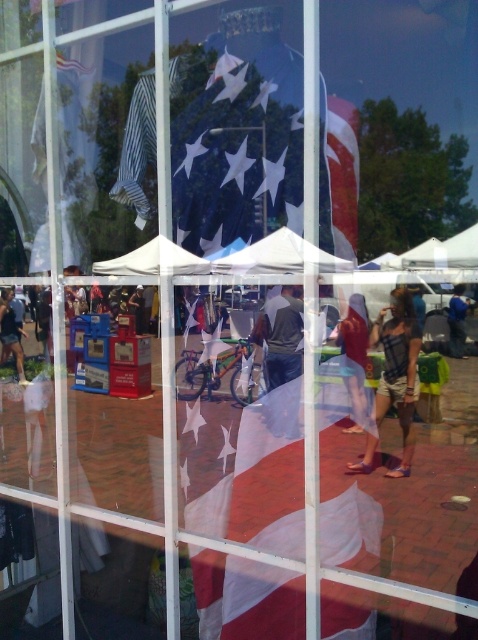
Question: Can you confirm if red fabric flag at center is thinner than light pink fabric at center?

Choices:
 (A) no
 (B) yes

Answer: (B)

Question: Which point is farther to the camera?

Choices:
 (A) light pink fabric at center
 (B) red fabric flag at center

Answer: (A)

Question: Estimate the real-world distances between objects in this image. Which object is farther from the light pink fabric at center?

Choices:
 (A) red fabric flag at center
 (B) dark gray backpack at center
 (C) plaid shirt at center

Answer: (A)

Question: Which point is closer to the camera taking this photo?

Choices:
 (A) (391, 291)
 (B) (362, 308)
 (C) (467, 308)

Answer: (B)

Question: Is plaid shirt at center positioned at the back of red fabric flag at center?

Choices:
 (A) yes
 (B) no

Answer: (A)

Question: Where is light pink fabric at center located in relation to light brown leather jacket at center in the image?

Choices:
 (A) below
 (B) above

Answer: (B)